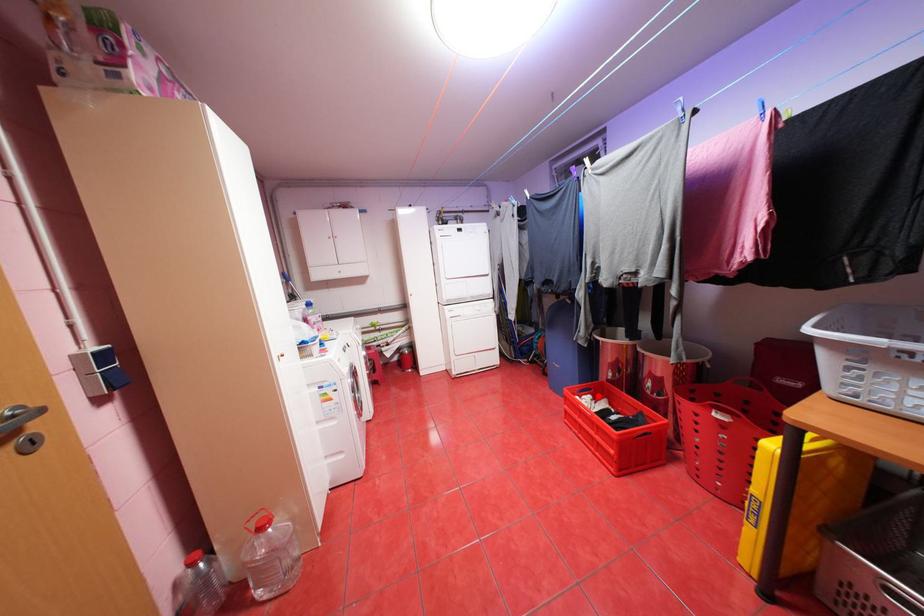
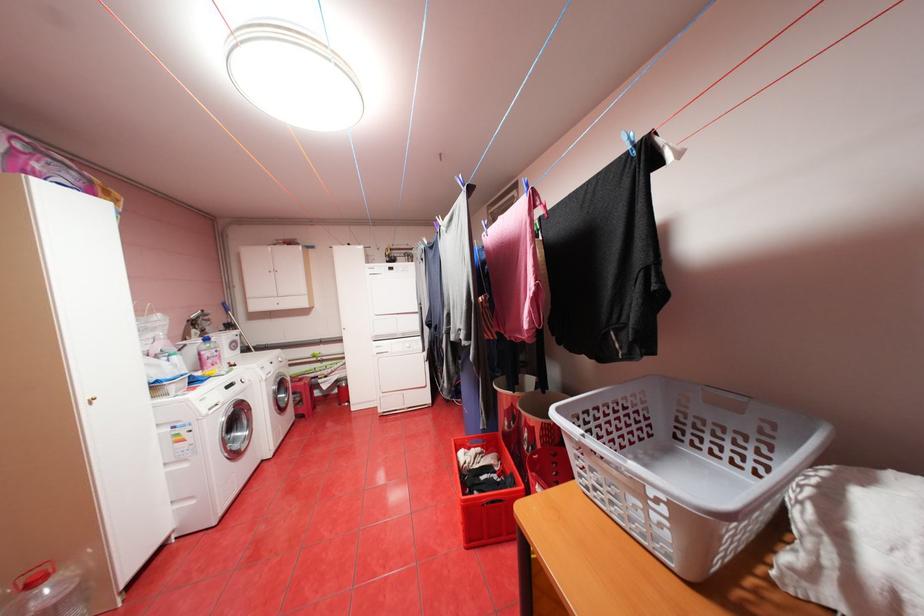
Question: I am providing you with two images of the same scene from different viewpoints. Image1 has a red point marked. In image2, the corresponding 3D location appears at what relative position? Reply with the corresponding letter.

Choices:
 (A) Closer
 (B) Farther

Answer: (B)